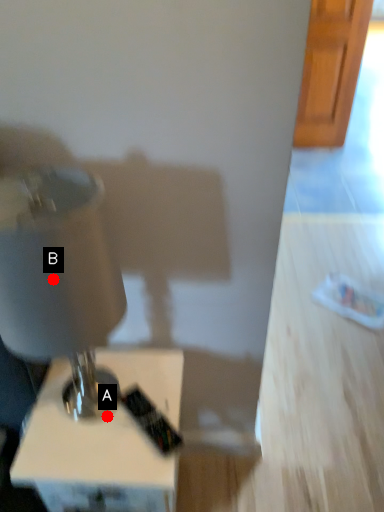
Question: Two points are circled on the image, labeled by A and B beside each circle. Which of the following is the closest to the observer?

Choices:
 (A) A is closer
 (B) B is closer

Answer: (B)